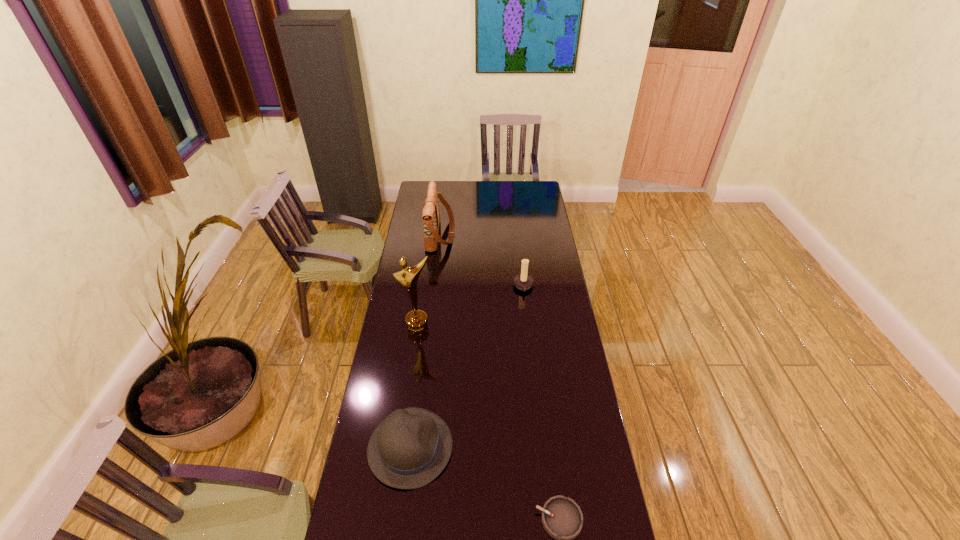
Find the location of a particular element. This screenshot has width=960, height=540. free region located 0.270m on the wick of the second farthest object is located at coordinates (457, 287).

Where is `free spot located 0.270m on the front-facing side of the fourth farthest object`? The width and height of the screenshot is (960, 540). free spot located 0.270m on the front-facing side of the fourth farthest object is located at coordinates (533, 448).

You are a GUI agent. You are given a task and a screenshot of the screen. Output one action in this format:
    pyautogui.click(x=<x>, y=<y>)
    Task: Click on the award that is at the left edge
    Image resolution: width=960 pixels, height=540 pixels.
    Given the screenshot: What is the action you would take?
    pyautogui.click(x=416, y=321)

I want to click on shoulder bag at the left edge, so click(x=431, y=215).

At what (x,y) coordinates should I click in order to perform the action: click on bowler hat that is positioned at the left edge. Please return your answer as a coordinate pair (x, y). The image size is (960, 540). Looking at the image, I should click on (410, 448).

The width and height of the screenshot is (960, 540). Identify the location of object situated at the right edge. (522, 281).

Find the location of `vacant space at the far edge of the desktop`. vacant space at the far edge of the desktop is located at coordinates (515, 189).

Where is `vacant area at the left edge of the desktop`? This screenshot has height=540, width=960. vacant area at the left edge of the desktop is located at coordinates (346, 515).

The image size is (960, 540). In the image, there is a desktop. Find the location of `free space at the right edge`. free space at the right edge is located at coordinates (567, 329).

Image resolution: width=960 pixels, height=540 pixels. I want to click on free point between the fourth farthest object and the candle holder, so click(467, 367).